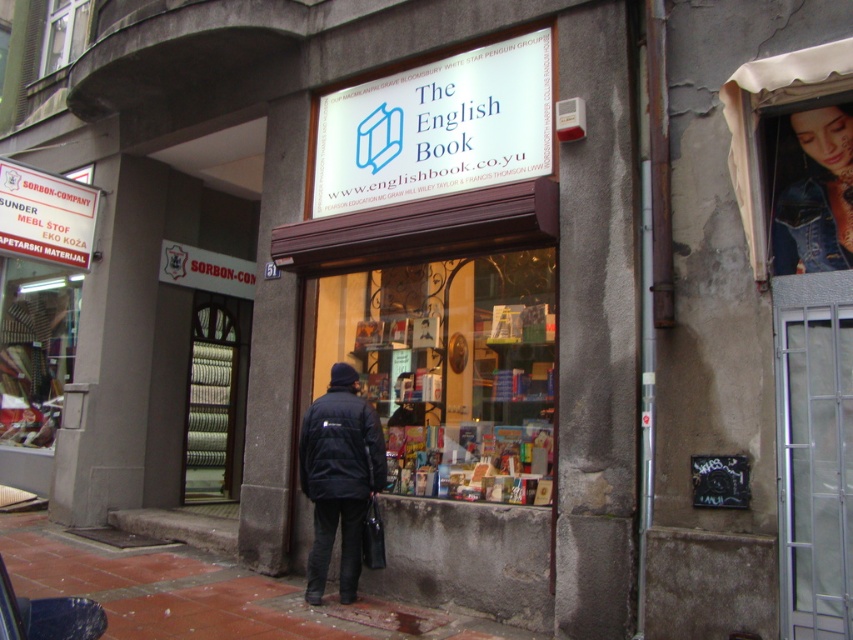
You are a delivery person carrying a package that is 2 meters long. You need to place it between the white plastic sign at center and the denim jacket at upper right. Can the package fit in the space between them?

The white plastic sign at center and the denim jacket at upper right are 2.18 meters apart, so the 2 meter long package can fit between them since the distance is greater than the package length.

You are standing in front of the bookstore and want to read the white plastic sign at center and the white plastic sign at upper left. Which one do you see first without moving your head?

You will see the white plastic sign at center first because it is closer to you than the white plastic sign at upper left.